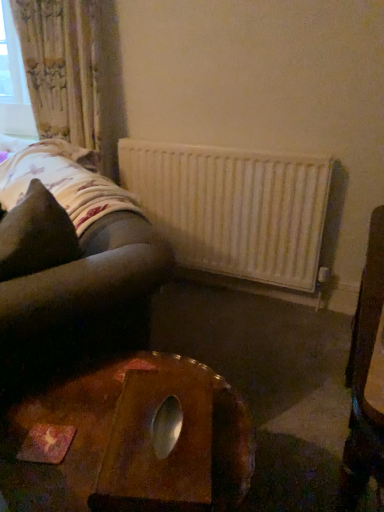
Image resolution: width=384 pixels, height=512 pixels. What are the coordinates of `brown fabric pillow at left` in the screenshot? It's located at (36, 234).

Where is `wooden table at center`? wooden table at center is located at coordinates (108, 435).

You are a GUI agent. You are given a task and a screenshot of the screen. Output one action in this format:
    pyautogui.click(x=<x>, y=<y>)
    Task: Click on the floral fabric curtain at upper left
    This screenshot has height=512, width=384.
    Given the screenshot: What is the action you would take?
    pyautogui.click(x=73, y=72)

From the image's perspective, is floral fabric curtain at upper left located above or below brown fabric pillow at left?

Clearly, from the image's perspective, floral fabric curtain at upper left is above brown fabric pillow at left.

Between floral fabric curtain at upper left and brown fabric pillow at left, which one has smaller size?

With smaller size is brown fabric pillow at left.

From a real-world perspective, does floral fabric curtain at upper left stand above brown fabric pillow at left?

Yes, from a real-world perspective, floral fabric curtain at upper left is above brown fabric pillow at left.

Is brown fabric pillow at left at the back of floral fabric curtain at upper left?

No.

Looking at their sizes, would you say wooden table at center is wider or thinner than floral fabric curtain at upper left?

Clearly, wooden table at center has more width compared to floral fabric curtain at upper left.

Do you think wooden table at center is within floral fabric curtain at upper left, or outside of it?

wooden table at center is located beyond the bounds of floral fabric curtain at upper left.

Is wooden table at center oriented away from floral fabric curtain at upper left?

No, wooden table at center is not facing away from floral fabric curtain at upper left.

Which is correct: wooden table at center is inside brown fabric pillow at left, or outside of it?

wooden table at center is not enclosed by brown fabric pillow at left.

Is wooden table at center not near brown fabric pillow at left?

No.

Considering the relative sizes of wooden table at center and brown fabric pillow at left in the image provided, is wooden table at center taller than brown fabric pillow at left?

Correct, wooden table at center is much taller as brown fabric pillow at left.

Is white matte radiator at center closer to camera compared to wooden table at center?

No, white matte radiator at center is further to the viewer.

Which of these two, white matte radiator at center or wooden table at center, is smaller?

With smaller size is white matte radiator at center.

Locate an element on the screen. Image resolution: width=384 pixels, height=512 pixels. table on the left of white matte radiator at center is located at coordinates (108, 435).

Is white matte radiator at center inside the boundaries of wooden table at center, or outside?

The correct answer is: outside.

From a real-world perspective, is brown fabric pillow at left below floral fabric curtain at upper left?

Indeed, from a real-world perspective, brown fabric pillow at left is positioned beneath floral fabric curtain at upper left.

Is brown fabric pillow at left shorter than floral fabric curtain at upper left?

Indeed, brown fabric pillow at left has a lesser height compared to floral fabric curtain at upper left.

The width and height of the screenshot is (384, 512). Find the location of `curtain lying behind the brown fabric pillow at left`. curtain lying behind the brown fabric pillow at left is located at coordinates (73, 72).

Is brown fabric pillow at left closer to the viewer compared to floral fabric curtain at upper left?

Yes, the depth of brown fabric pillow at left is less than that of floral fabric curtain at upper left.

Considering the relative sizes of white matte radiator at center and floral fabric curtain at upper left in the image provided, is white matte radiator at center wider than floral fabric curtain at upper left?

No, white matte radiator at center is not wider than floral fabric curtain at upper left.

Considering the positions of objects white matte radiator at center and floral fabric curtain at upper left in the image provided, who is more to the left, white matte radiator at center or floral fabric curtain at upper left?

From the viewer's perspective, floral fabric curtain at upper left appears more on the left side.

Measure the distance between white matte radiator at center and floral fabric curtain at upper left.

The distance of white matte radiator at center from floral fabric curtain at upper left is 23.02 inches.

Is white matte radiator at center bigger or smaller than floral fabric curtain at upper left?

Considering their sizes, white matte radiator at center takes up less space than floral fabric curtain at upper left.

From a real-world perspective, which is physically above, floral fabric curtain at upper left or wooden table at center?

From a 3D spatial view, floral fabric curtain at upper left is above.

Considering the positions of objects floral fabric curtain at upper left and wooden table at center in the image provided, who is more to the left, floral fabric curtain at upper left or wooden table at center?

floral fabric curtain at upper left is more to the left.

Is floral fabric curtain at upper left aimed at wooden table at center?

No, floral fabric curtain at upper left does not turn towards wooden table at center.

Which is behind, floral fabric curtain at upper left or wooden table at center?

floral fabric curtain at upper left is more distant.

In the image, there is a floral fabric curtain at upper left. Where is `throw pillow below it (from a real-world perspective)`? The width and height of the screenshot is (384, 512). throw pillow below it (from a real-world perspective) is located at coordinates (36, 234).

In the image, there is a floral fabric curtain at upper left. Where is `table below it (from the image's perspective)`? table below it (from the image's perspective) is located at coordinates (108, 435).

When comparing their distances from white matte radiator at center, does wooden table at center or floral fabric curtain at upper left seem closer?

floral fabric curtain at upper left.

Based on their spatial positions, is brown fabric pillow at left or white matte radiator at center closer to floral fabric curtain at upper left?

Based on the image, white matte radiator at center appears to be nearer to floral fabric curtain at upper left.

Looking at the image, which one is located further to wooden table at center, brown fabric pillow at left or floral fabric curtain at upper left?

floral fabric curtain at upper left is further to wooden table at center.

Which object lies nearer to the anchor point brown fabric pillow at left, white matte radiator at center or floral fabric curtain at upper left?

Among the two, white matte radiator at center is located nearer to brown fabric pillow at left.

From the image, which object appears to be nearer to brown fabric pillow at left, white matte radiator at center or wooden table at center?

Based on the image, wooden table at center appears to be nearer to brown fabric pillow at left.

Looking at the image, which one is located further to wooden table at center, white matte radiator at center or floral fabric curtain at upper left?

The object further to wooden table at center is floral fabric curtain at upper left.

When comparing their distances from wooden table at center, does floral fabric curtain at upper left or white matte radiator at center seem further?

Based on the image, floral fabric curtain at upper left appears to be further to wooden table at center.

Based on their spatial positions, is floral fabric curtain at upper left or brown fabric pillow at left closer to wooden table at center?

brown fabric pillow at left is closer to wooden table at center.

Where is `throw pillow between wooden table at center and floral fabric curtain at upper left along the z-axis`? Image resolution: width=384 pixels, height=512 pixels. throw pillow between wooden table at center and floral fabric curtain at upper left along the z-axis is located at coordinates (36, 234).

Where is `throw pillow positioned between wooden table at center and white matte radiator at center from near to far`? The height and width of the screenshot is (512, 384). throw pillow positioned between wooden table at center and white matte radiator at center from near to far is located at coordinates pyautogui.click(x=36, y=234).

Find the location of `radiator located between brown fabric pillow at left and floral fabric curtain at upper left in the depth direction`. radiator located between brown fabric pillow at left and floral fabric curtain at upper left in the depth direction is located at coordinates (234, 209).

Identify the location of radiator between wooden table at center and floral fabric curtain at upper left from front to back. This screenshot has height=512, width=384. click(x=234, y=209).